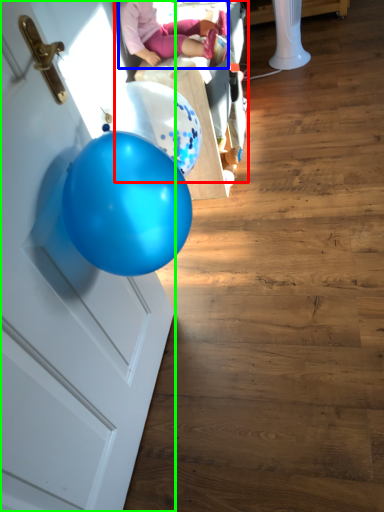
Question: Which is farther away from baby carriage (highlighted by a red box)? person (highlighted by a blue box) or door (highlighted by a green box)?

Choices:
 (A) person
 (B) door

Answer: (B)